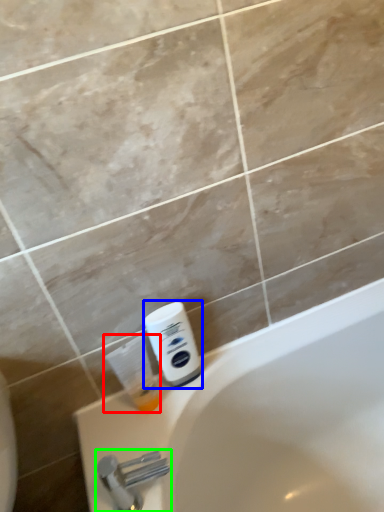
Question: Based on their relative distances, which object is nearer to cleaning product (highlighted by a red box)? Choose from shaving cream (highlighted by a blue box) and tap (highlighted by a green box).

Choices:
 (A) shaving cream
 (B) tap

Answer: (A)